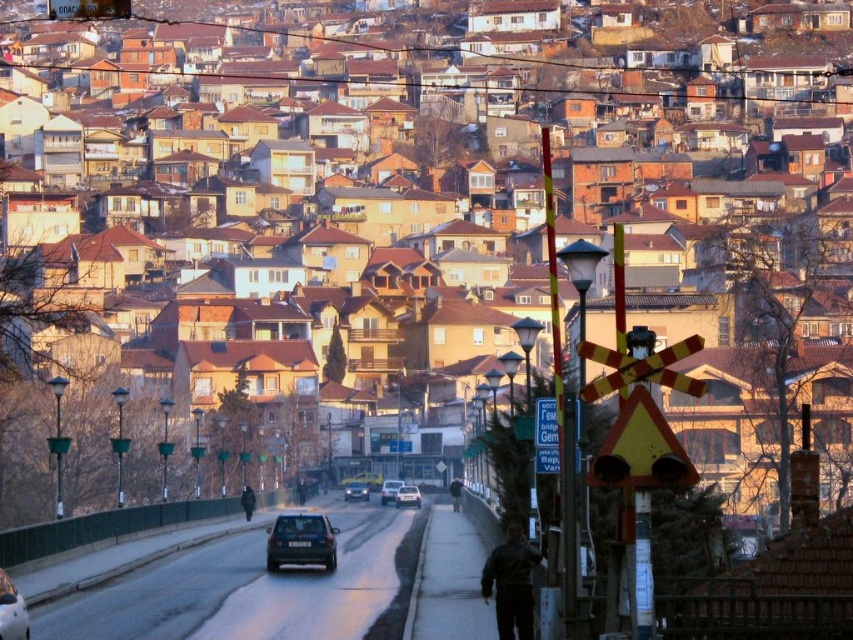
You are a delivery driver who needs to park your car at the railway crossing signal. The railway crossing signal is located at point 0.5,0.5. Can you park your shiny silver sedan at center there?

The shiny silver sedan at center is located at point (407,497), which is not at the railway crossing signal located at (426,320). Therefore, you cannot park the shiny silver sedan at center there.

You are a pedestrian standing at the railway crossing signal. You see a yellow plastic traffic sign at center and a black leather jacket at center. Which object is closer to you?

The yellow plastic traffic sign at center is closer to the viewer than the black leather jacket at center.

You are a delivery driver who needs to park your vehicle near the railway crossing signal. The parking spot is marked by the point at coordinates (x=407, y=497). Is there enough space to park your truck here?

The point at coordinates (x=407, y=497) corresponds to a shiny silver sedan at center, so there is not enough space to park a truck there because a car is already occupying that spot.